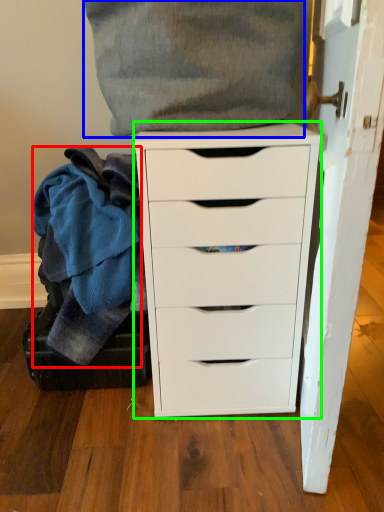
Question: Which object is positioned farthest from clothing (highlighted by a red box)? Select from clothing (highlighted by a blue box) and chest of drawers (highlighted by a green box).

Choices:
 (A) clothing
 (B) chest of drawers

Answer: (A)